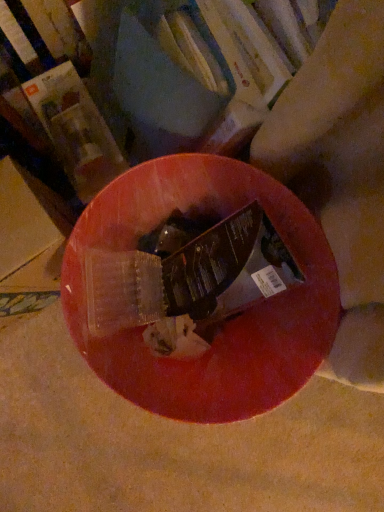
Question: Is matte plastic book at upper left, the first book positioned from the left, bigger or smaller than hardcover book at center, placed as the second book when sorted from left to right?

Choices:
 (A) big
 (B) small

Answer: (B)

Question: From a real-world perspective, is matte plastic book at upper left, the first book positioned from the left, positioned above or below hardcover book at center, placed as the second book when sorted from left to right?

Choices:
 (A) below
 (B) above

Answer: (A)

Question: In terms of height, does matte plastic book at upper left, which ranks as the 2th book in right-to-left order, look taller or shorter compared to hardcover book at center, which is counted as the first book, starting from the right?

Choices:
 (A) tall
 (B) short

Answer: (B)

Question: In terms of height, does hardcover book at center, which is counted as the first book, starting from the right, look taller or shorter compared to matte plastic book at upper left, which ranks as the 2th book in right-to-left order?

Choices:
 (A) short
 (B) tall

Answer: (B)

Question: Based on their positions, is hardcover book at center, which is counted as the first book, starting from the right, located to the left or right of matte plastic book at upper left, the first book positioned from the left?

Choices:
 (A) right
 (B) left

Answer: (A)

Question: From a real-world perspective, is hardcover book at center, placed as the second book when sorted from left to right, physically located above or below matte plastic book at upper left, which ranks as the 2th book in right-to-left order?

Choices:
 (A) above
 (B) below

Answer: (A)

Question: Do you think hardcover book at center, placed as the second book when sorted from left to right, is within matte plastic book at upper left, which ranks as the 2th book in right-to-left order, or outside of it?

Choices:
 (A) outside
 (B) inside

Answer: (A)